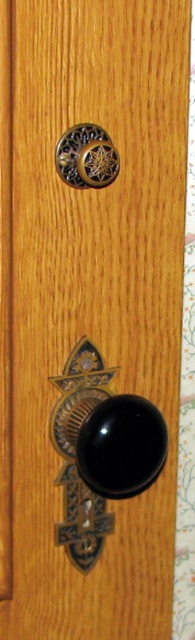
Which is above, black polished metal door handle at center or gold textured knob at upper center?

gold textured knob at upper center is higher up.

Is black polished metal door handle at center bigger than gold textured knob at upper center?

Correct, black polished metal door handle at center is larger in size than gold textured knob at upper center.

At what (x,y) coordinates should I click in order to perform the action: click on black polished metal door handle at center. Please return your answer as a coordinate pair (x, y). The image size is (195, 640). Looking at the image, I should click on (75, 452).

Find the location of a particular element. black polished metal door handle at center is located at coordinates (75, 452).